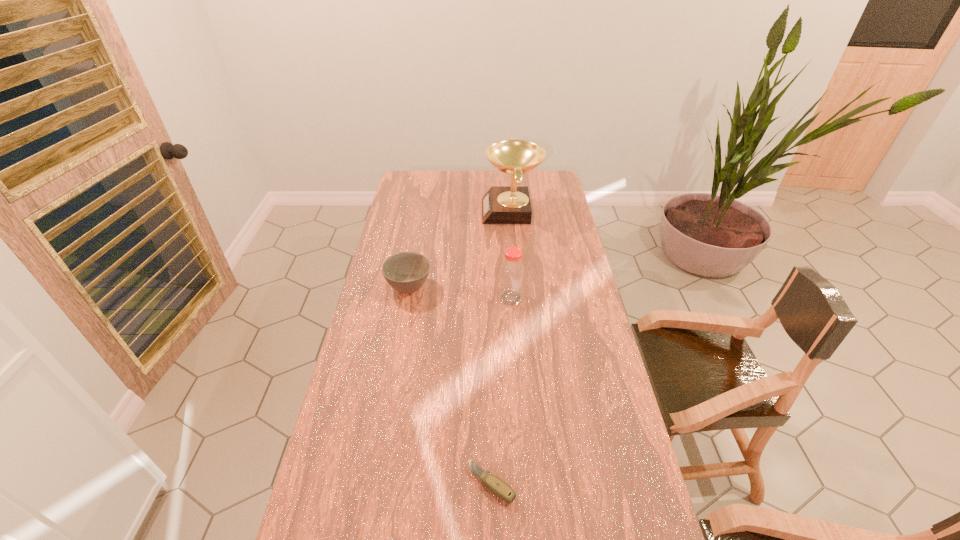
I want to click on award, so click(x=511, y=204).

Locate an element on the screen. The height and width of the screenshot is (540, 960). the farthest object is located at coordinates (511, 204).

This screenshot has width=960, height=540. I want to click on the third shortest object, so click(x=512, y=271).

Locate an element on the screen. The image size is (960, 540). bowl is located at coordinates (406, 272).

You are a GUI agent. You are given a task and a screenshot of the screen. Output one action in this format:
    pyautogui.click(x=<x>, y=<y>)
    Task: Click on the third tallest object
    Image resolution: width=960 pixels, height=540 pixels.
    Given the screenshot: What is the action you would take?
    pyautogui.click(x=406, y=272)

The height and width of the screenshot is (540, 960). Identify the location of pocketknife. (497, 486).

Identify the location of the nearest object. The width and height of the screenshot is (960, 540). (497, 486).

Where is `vacant point located 0.150m on the front-facing side of the farthest object`? This screenshot has width=960, height=540. vacant point located 0.150m on the front-facing side of the farthest object is located at coordinates (449, 211).

Identify the location of free location located on the front-facing side of the farthest object. This screenshot has width=960, height=540. (406, 211).

Locate an element on the screen. This screenshot has width=960, height=540. vacant space located 0.120m on the front-facing side of the farthest object is located at coordinates (456, 211).